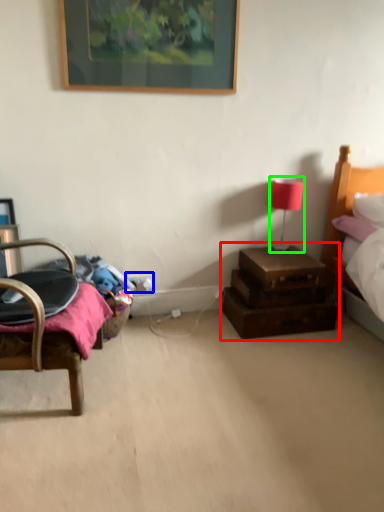
Question: Which object is the farthest from nightstand (highlighted by a red box)? Choose among these: electric outlet (highlighted by a blue box) or table lamp (highlighted by a green box).

Choices:
 (A) electric outlet
 (B) table lamp

Answer: (A)